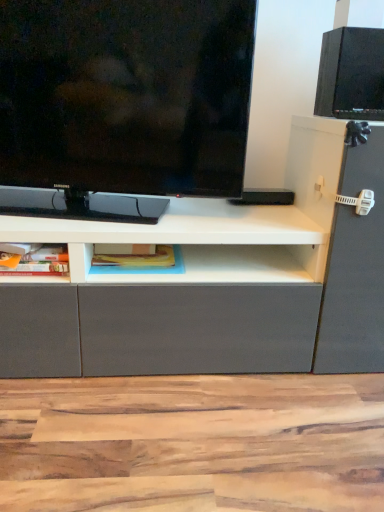
Image resolution: width=384 pixels, height=512 pixels. Find the location of `blue matte bookshelf at center, acting as the 2th cabinet starting from the left`. blue matte bookshelf at center, acting as the 2th cabinet starting from the left is located at coordinates (143, 267).

Describe the element at coordinates (143, 267) in the screenshot. I see `blue matte bookshelf at center, the first cabinet positioned from the right` at that location.

Identify the location of black matte speaker at upper right. (351, 74).

From the image's perspective, is blue matte bookshelf at center, the first cabinet positioned from the right, above matte black tv at upper left?

No, from the image's perspective, blue matte bookshelf at center, the first cabinet positioned from the right, is not above matte black tv at upper left.

Is blue matte bookshelf at center, acting as the 2th cabinet starting from the left, positioned beyond the bounds of matte black tv at upper left?

Yes.

Which object is wider, blue matte bookshelf at center, the first cabinet positioned from the right, or matte black tv at upper left?

Wider between the two is blue matte bookshelf at center, the first cabinet positioned from the right.

Identify the location of television above the blue matte bookshelf at center, the first cabinet positioned from the right (from a real-world perspective). The width and height of the screenshot is (384, 512). (123, 102).

From a real-world perspective, between blue matte bookshelf at center, acting as the 2th cabinet starting from the left, and black matte speaker at upper right, who is vertically higher?

black matte speaker at upper right is physically above.

Is there a large distance between blue matte bookshelf at center, the first cabinet positioned from the right, and black matte speaker at upper right?

No, there isn't a large distance between blue matte bookshelf at center, the first cabinet positioned from the right, and black matte speaker at upper right.

Between blue matte bookshelf at center, acting as the 2th cabinet starting from the left, and black matte speaker at upper right, which one has more height?

Standing taller between the two is black matte speaker at upper right.

From the image's perspective, is blue matte bookshelf at center, acting as the 2th cabinet starting from the left, beneath black matte speaker at upper right?

Indeed, from the image's perspective, blue matte bookshelf at center, acting as the 2th cabinet starting from the left, is shown beneath black matte speaker at upper right.

From the picture: Which object is thinner, black matte speaker at upper right or blue matte bookshelf at center, acting as the 2th cabinet starting from the left?

Thinner between the two is black matte speaker at upper right.

Which of these two, black matte speaker at upper right or blue matte bookshelf at center, the first cabinet positioned from the right, is smaller?

blue matte bookshelf at center, the first cabinet positioned from the right.

Does black matte speaker at upper right turn towards blue matte bookshelf at center, acting as the 2th cabinet starting from the left?

No, black matte speaker at upper right is not turned towards blue matte bookshelf at center, acting as the 2th cabinet starting from the left.

Is black matte speaker at upper right to the left of blue matte bookshelf at center, acting as the 2th cabinet starting from the left, from the viewer's perspective?

Incorrect, black matte speaker at upper right is not on the left side of blue matte bookshelf at center, acting as the 2th cabinet starting from the left.

How different are the orientations of black matte speaker at upper right and matte plastic container at lower left, placed as the first cabinet when sorted from left to right, in degrees?

The angle between the facing direction of black matte speaker at upper right and the facing direction of matte plastic container at lower left, placed as the first cabinet when sorted from left to right, is 1.9 degrees.

Considering the sizes of black matte speaker at upper right and matte plastic container at lower left, which is the second cabinet from right to left, in the image, is black matte speaker at upper right bigger or smaller than matte plastic container at lower left, which is the second cabinet from right to left,?

black matte speaker at upper right is bigger than matte plastic container at lower left, which is the second cabinet from right to left.

Identify the location of speaker behind the matte plastic container at lower left, placed as the first cabinet when sorted from left to right. This screenshot has height=512, width=384. (351, 74).

Considering the relative sizes of black matte speaker at upper right and matte plastic container at lower left, which is the second cabinet from right to left, in the image provided, is black matte speaker at upper right thinner than matte plastic container at lower left, which is the second cabinet from right to left,?

Indeed, black matte speaker at upper right has a lesser width compared to matte plastic container at lower left, which is the second cabinet from right to left.

Who is smaller, matte black tv at upper left or matte plastic container at lower left, placed as the first cabinet when sorted from left to right?

matte plastic container at lower left, placed as the first cabinet when sorted from left to right, is smaller.

Image resolution: width=384 pixels, height=512 pixels. Find the location of `cabinet that is the 1st object located behind the matte black tv at upper left`. cabinet that is the 1st object located behind the matte black tv at upper left is located at coordinates (36, 261).

Consider the image. Can you confirm if matte black tv at upper left is taller than matte plastic container at lower left, which is the second cabinet from right to left?

Yes, matte black tv at upper left is taller than matte plastic container at lower left, which is the second cabinet from right to left.

Measure the distance from matte black tv at upper left to blue matte bookshelf at center, acting as the 2th cabinet starting from the left.

14.82 inches.

Is blue matte bookshelf at center, the first cabinet positioned from the right, at the back of matte black tv at upper left?

No, blue matte bookshelf at center, the first cabinet positioned from the right, is not at the back of matte black tv at upper left.

Are matte black tv at upper left and blue matte bookshelf at center, the first cabinet positioned from the right, far apart?

They are positioned close to each other.

Where is `the 2nd cabinet behind the matte black tv at upper left`? The height and width of the screenshot is (512, 384). the 2nd cabinet behind the matte black tv at upper left is located at coordinates (143, 267).

Does point (19, 272) appear closer or farther from the camera than point (98, 268)?

Point (19, 272).

Is matte plastic container at lower left, placed as the first cabinet when sorted from left to right, facing towards blue matte bookshelf at center, acting as the 2th cabinet starting from the left?

No, matte plastic container at lower left, placed as the first cabinet when sorted from left to right, is not aimed at blue matte bookshelf at center, acting as the 2th cabinet starting from the left.

From a real-world perspective, who is located lower, matte plastic container at lower left, which is the second cabinet from right to left, or blue matte bookshelf at center, acting as the 2th cabinet starting from the left?

blue matte bookshelf at center, acting as the 2th cabinet starting from the left.

In terms of size, does matte plastic container at lower left, which is the second cabinet from right to left, appear bigger or smaller than blue matte bookshelf at center, the first cabinet positioned from the right?

matte plastic container at lower left, which is the second cabinet from right to left, is smaller than blue matte bookshelf at center, the first cabinet positioned from the right.

Identify the location of television that is on the left side of blue matte bookshelf at center, acting as the 2th cabinet starting from the left. The image size is (384, 512). pos(123,102).

There is a black matte speaker at upper right. Where is `the 2nd cabinet below it (from a real-world perspective)`? The image size is (384, 512). the 2nd cabinet below it (from a real-world perspective) is located at coordinates (143, 267).

Looking at the image, which one is located closer to matte plastic container at lower left, placed as the first cabinet when sorted from left to right, blue matte bookshelf at center, the first cabinet positioned from the right, or matte black tv at upper left?

blue matte bookshelf at center, the first cabinet positioned from the right, is closer to matte plastic container at lower left, placed as the first cabinet when sorted from left to right.

Based on their spatial positions, is matte black tv at upper left or matte plastic container at lower left, which is the second cabinet from right to left, closer to blue matte bookshelf at center, the first cabinet positioned from the right?

matte plastic container at lower left, which is the second cabinet from right to left, is positioned closer to the anchor blue matte bookshelf at center, the first cabinet positioned from the right.

Which object lies further to the anchor point matte black tv at upper left, black matte speaker at upper right or matte plastic container at lower left, which is the second cabinet from right to left?

black matte speaker at upper right is positioned further to the anchor matte black tv at upper left.

Which object lies further to the anchor point matte black tv at upper left, black matte speaker at upper right or blue matte bookshelf at center, acting as the 2th cabinet starting from the left?

black matte speaker at upper right.

From the image, which object appears to be farther from blue matte bookshelf at center, the first cabinet positioned from the right, matte plastic container at lower left, which is the second cabinet from right to left, or black matte speaker at upper right?

black matte speaker at upper right.

Based on the photo, looking at the image, which one is located further to black matte speaker at upper right, matte black tv at upper left or matte plastic container at lower left, which is the second cabinet from right to left?

The object further to black matte speaker at upper right is matte plastic container at lower left, which is the second cabinet from right to left.

Considering their positions, is matte black tv at upper left positioned closer to matte plastic container at lower left, placed as the first cabinet when sorted from left to right, than blue matte bookshelf at center, the first cabinet positioned from the right?

blue matte bookshelf at center, the first cabinet positioned from the right, lies closer to matte plastic container at lower left, placed as the first cabinet when sorted from left to right, than the other object.

When comparing their distances from black matte speaker at upper right, does blue matte bookshelf at center, the first cabinet positioned from the right, or matte black tv at upper left seem closer?

Based on the image, matte black tv at upper left appears to be nearer to black matte speaker at upper right.

Identify the location of cabinet between matte plastic container at lower left, placed as the first cabinet when sorted from left to right, and black matte speaker at upper right. Image resolution: width=384 pixels, height=512 pixels. (143, 267).

I want to click on television between matte plastic container at lower left, placed as the first cabinet when sorted from left to right, and black matte speaker at upper right, so click(123, 102).

Where is `cabinet between matte black tv at upper left and black matte speaker at upper right from left to right`? cabinet between matte black tv at upper left and black matte speaker at upper right from left to right is located at coordinates (143, 267).

Locate an element on the screen. cabinet between matte black tv at upper left and matte plastic container at lower left, which is the second cabinet from right to left, in the up-down direction is located at coordinates click(x=143, y=267).